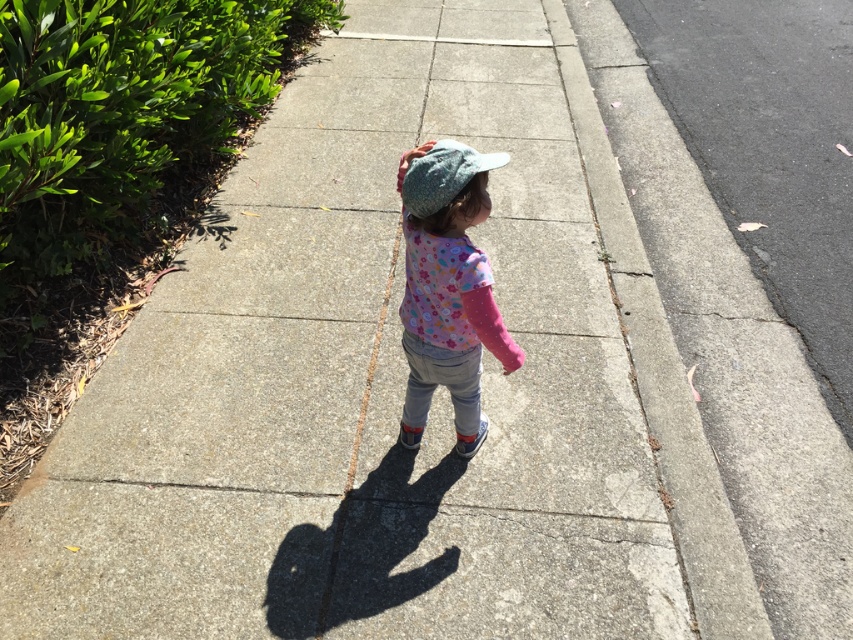
Question: Which point is farther from the camera taking this photo?

Choices:
 (A) (442, 161)
 (B) (442, 337)

Answer: (B)

Question: Which of the following is the farthest from the observer?

Choices:
 (A) (613, 179)
 (B) (508, 353)

Answer: (A)

Question: Is fluffy cotton hat at center positioned before knitted blue cap at center?

Choices:
 (A) yes
 (B) no

Answer: (B)

Question: Does gray concrete curb at right have a greater width compared to knitted blue cap at center?

Choices:
 (A) yes
 (B) no

Answer: (A)

Question: Is gray concrete curb at right positioned behind knitted blue cap at center?

Choices:
 (A) yes
 (B) no

Answer: (A)

Question: Estimate the real-world distances between objects in this image. Which object is closer to the gray concrete curb at right?

Choices:
 (A) knitted blue cap at center
 (B) fluffy cotton hat at center

Answer: (B)